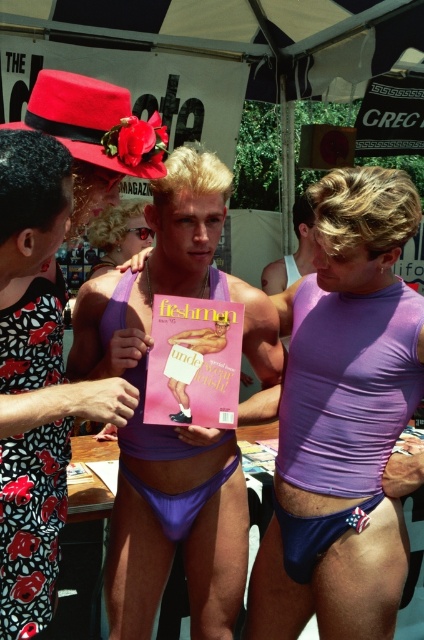
This screenshot has height=640, width=424. What do you see at coordinates (343, 419) in the screenshot? I see `purple matte underwear at center` at bounding box center [343, 419].

Can you confirm if purple matte underwear at center is positioned below pink matte magazine at center?

Yes, purple matte underwear at center is below pink matte magazine at center.

Is point (340, 278) closer to camera compared to point (208, 321)?

Yes.

The height and width of the screenshot is (640, 424). I want to click on purple matte underwear at center, so click(x=343, y=419).

Which is more to the right, pink matte magazine at center or purple fabric bikini bottom at center?

Positioned to the right is pink matte magazine at center.

Between pink matte magazine at center and purple fabric bikini bottom at center, which one appears on the left side from the viewer's perspective?

purple fabric bikini bottom at center

Identify the location of pink matte magazine at center. This screenshot has height=640, width=424. (194, 362).

Between matte purple bikini bottom at center and blonde hair wig at center, which one is positioned higher?

Positioned higher is blonde hair wig at center.

Between point (41, 429) and point (102, 234), which one is positioned behind?

Positioned behind is point (102, 234).

The width and height of the screenshot is (424, 640). I want to click on matte purple bikini bottom at center, so click(x=36, y=380).